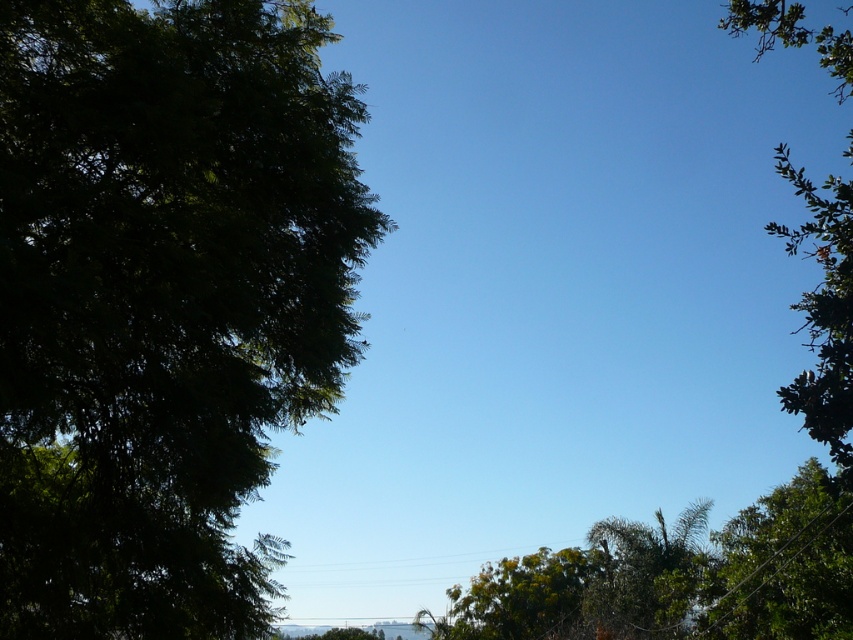
Is green leafy tree at upper right further to camera compared to green leafy tree at center?

That is False.

Can you confirm if green leafy tree at upper right is positioned above green leafy tree at center?

Indeed, green leafy tree at upper right is positioned over green leafy tree at center.

Between point (793, 28) and point (546, 561), which one is positioned behind?

Point (546, 561)

The width and height of the screenshot is (853, 640). Find the location of `green leafy tree at upper right`. green leafy tree at upper right is located at coordinates (824, 314).

Which is in front, point (56, 634) or point (796, 492)?

Point (56, 634) is more forward.

Between point (274, 49) and point (711, 568), which one is positioned behind?

The point (711, 568) is more distant.

Is point (228, 403) positioned in front of point (838, 589)?

Yes, it is.

Find the location of a particular element. This screenshot has height=640, width=853. green leafy tree at left is located at coordinates (163, 300).

Can you confirm if green leafy tree at left is taller than green leafy tree at center?

In fact, green leafy tree at left may be shorter than green leafy tree at center.

Can you confirm if green leafy tree at left is wider than green leafy tree at center?

No, green leafy tree at left is not wider than green leafy tree at center.

Between point (219, 387) and point (544, 579), which one is positioned behind?

Positioned behind is point (544, 579).

Find the location of a particular element. green leafy tree at left is located at coordinates (163, 300).